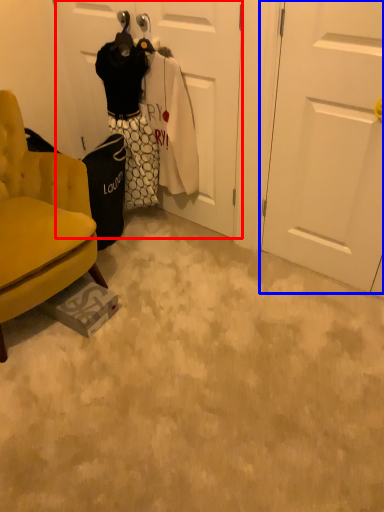
Question: Among these objects, which one is farthest to the camera, door (highlighted by a red box) or door (highlighted by a blue box)?

Choices:
 (A) door
 (B) door

Answer: (A)